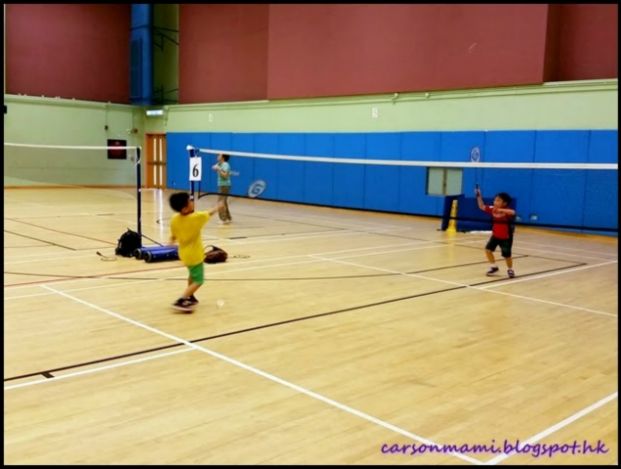
At what (x,y) coordinates should I click in order to perform the action: click on door. Please return your answer as a coordinate pair (x, y). Looking at the image, I should click on (156, 153).